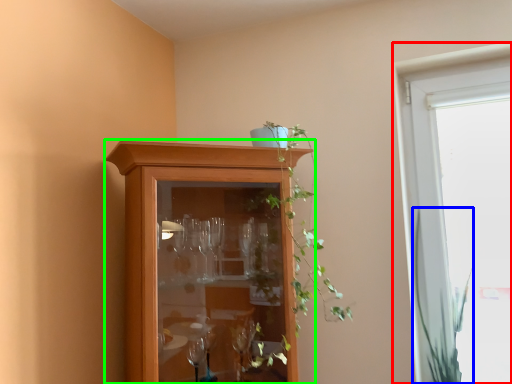
Question: Which object is positioned closest to window (highlighted by a red box)? Select from vegetation (highlighted by a blue box) and cupboard (highlighted by a green box).

Choices:
 (A) vegetation
 (B) cupboard

Answer: (A)